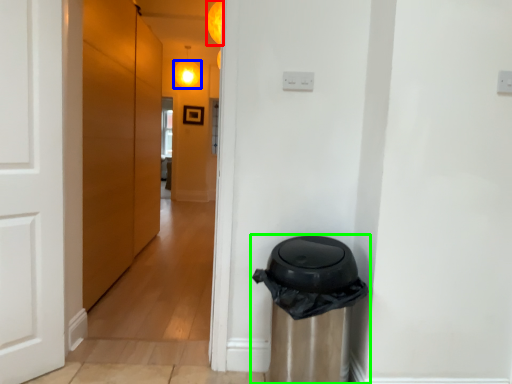
Question: Based on their relative distances, which object is farther from light (highlighted by a red box)? Choose from light (highlighted by a blue box) and waste container (highlighted by a green box).

Choices:
 (A) light
 (B) waste container

Answer: (A)